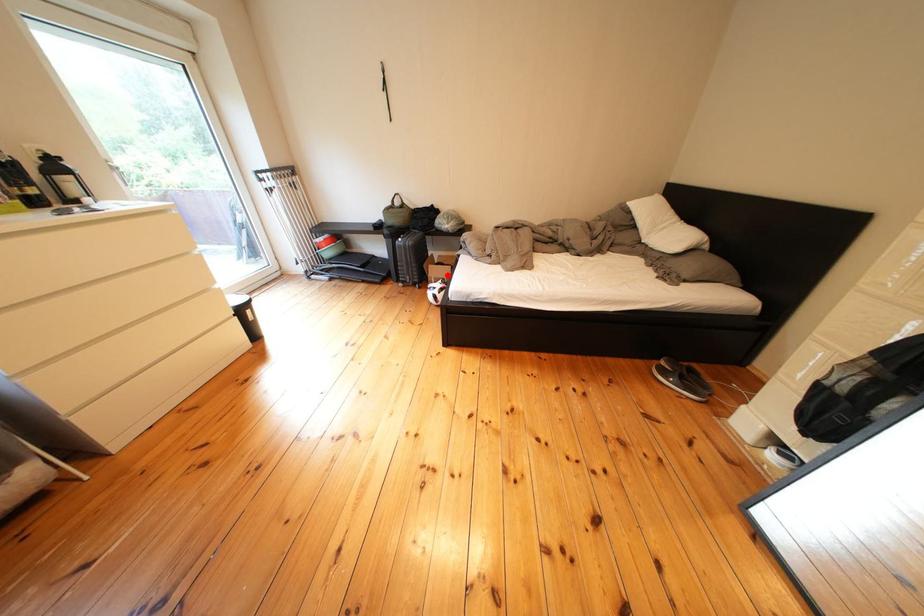
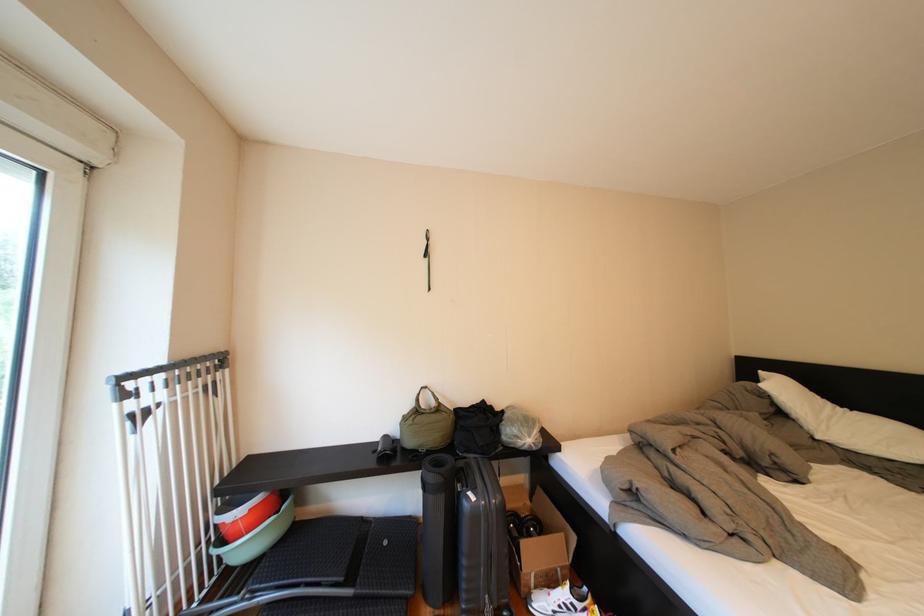
Question: I am providing you with two images of the same scene from different viewpoints. Image1 has a red point marked. In image2, the corresponding 3D location appears at what relative position? Reply with the corresponding letter.

Choices:
 (A) Closer
 (B) Farther

Answer: (A)